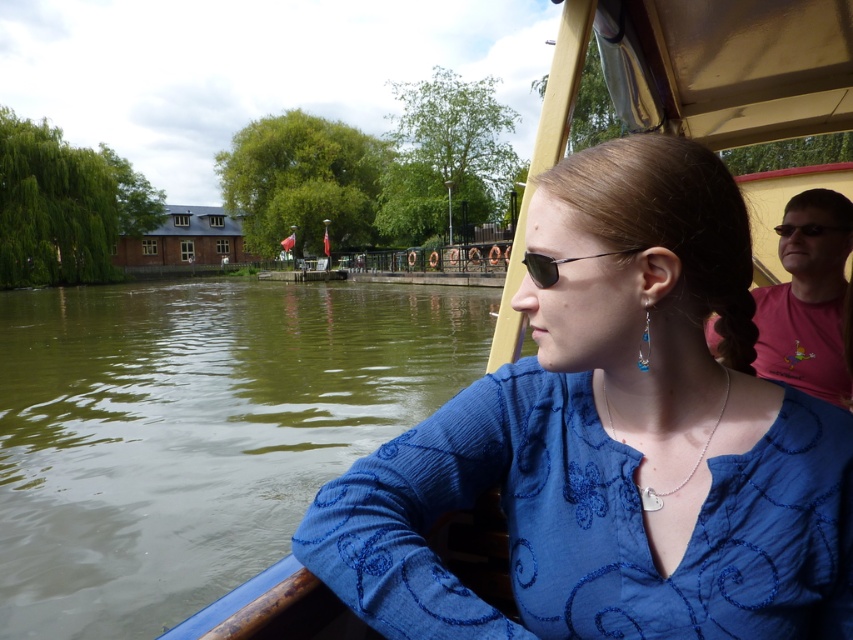
Who is shorter, silver/chain necklace at center or black plastic sunglasses at center?

Standing shorter between the two is black plastic sunglasses at center.

Looking at this image, who is positioned more to the left, silver/chain necklace at center or black plastic sunglasses at center?

From the viewer's perspective, black plastic sunglasses at center appears more on the left side.

The height and width of the screenshot is (640, 853). What do you see at coordinates (692, 465) in the screenshot?
I see `silver/chain necklace at center` at bounding box center [692, 465].

Identify the location of silver/chain necklace at center. This screenshot has height=640, width=853. (692, 465).

Who is positioned more to the right, green water at left or black plastic sunglasses at center?

Positioned to the right is black plastic sunglasses at center.

Who is lower down, green water at left or black plastic sunglasses at center?

black plastic sunglasses at center

This screenshot has width=853, height=640. Find the location of `green water at left`. green water at left is located at coordinates (196, 429).

Where is `green water at left`? green water at left is located at coordinates (196, 429).

Locate an element on the screen. blue knitted sweater at center is located at coordinates (614, 440).

Can you confirm if blue knitted sweater at center is positioned to the left of blue textured fabric at lower left?

In fact, blue knitted sweater at center is to the right of blue textured fabric at lower left.

Identify the location of blue knitted sweater at center. (614, 440).

At what (x,y) coordinates should I click in order to perform the action: click on blue knitted sweater at center. Please return your answer as a coordinate pair (x, y). This screenshot has height=640, width=853. Looking at the image, I should click on (614, 440).